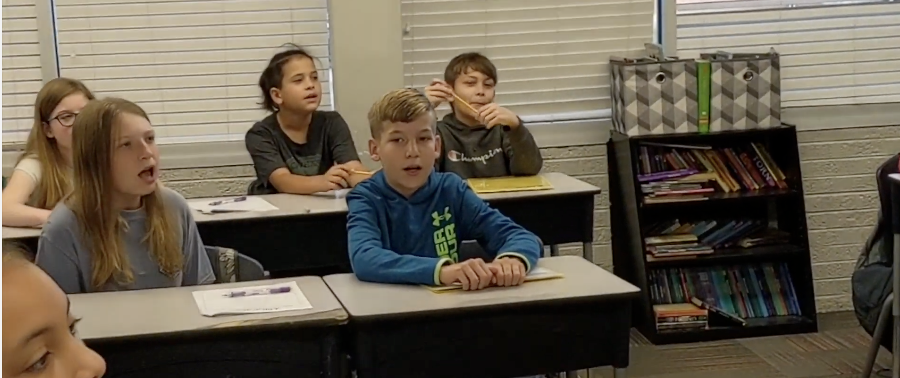
I want to click on shelving, so click(x=707, y=217).